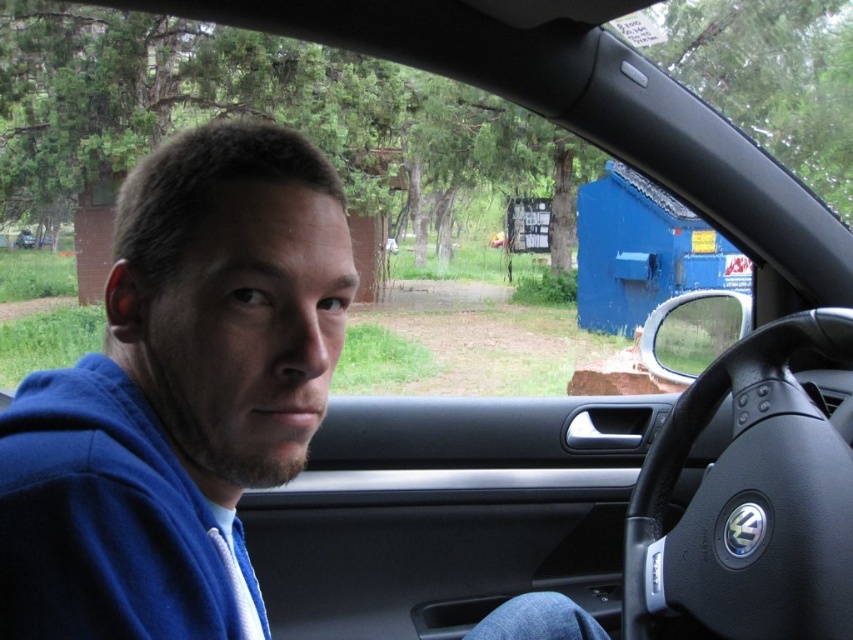
Based on the photo, you are a fashion designer observing a person wearing a blue fleece sweatshirt at left and holding a black leather steering wheel at center. Which clothing item is narrower?

The blue fleece sweatshirt at left is narrower than the black leather steering wheel at center.

You are standing outside the car and want to reach the steering wheel inside the car. Given that the distance between the black leather steering wheel at center and the matte black car at center is 31.07 meters, can you safely walk towards the steering wheel without entering the car?

The black leather steering wheel at center is 31.07 meters away from the matte black car at center, which means the steering wheel is located far away from the car. Therefore, you cannot safely reach it without entering the car.